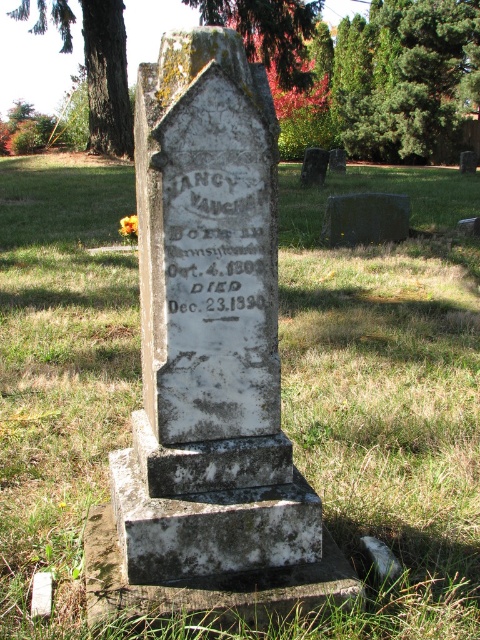
Question: Is white stone gravestone at center to the right of green leafy tree at upper center from the viewer's perspective?

Choices:
 (A) no
 (B) yes

Answer: (A)

Question: Which object is positioned closest to the white stone gravestone at center?

Choices:
 (A) green leafy tree at upper center
 (B) smooth gray stone at center
 (C) green mossy tree at upper left

Answer: (B)

Question: Can you confirm if green mossy tree at upper left is smaller than smooth bark tree at upper left?

Choices:
 (A) no
 (B) yes

Answer: (A)

Question: Considering the relative positions of black stone inscription at center and dark gray stone at center in the image provided, where is black stone inscription at center located with respect to dark gray stone at center?

Choices:
 (A) above
 (B) below

Answer: (B)

Question: Estimate the real-world distances between objects in this image. Which object is closer to the dark gray stone at center?

Choices:
 (A) smooth bark tree at upper left
 (B) green leafy tree at upper center
 (C) smooth gray stone at center
 (D) black stone inscription at center

Answer: (D)

Question: Which object is farther from the camera taking this photo?

Choices:
 (A) green mossy tree at upper left
 (B) white marble gravestone at center

Answer: (B)